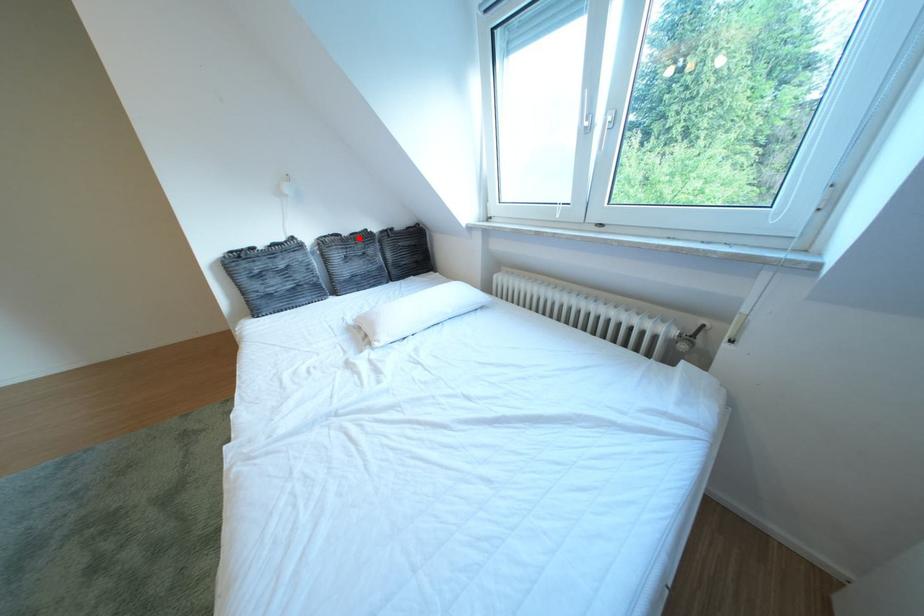
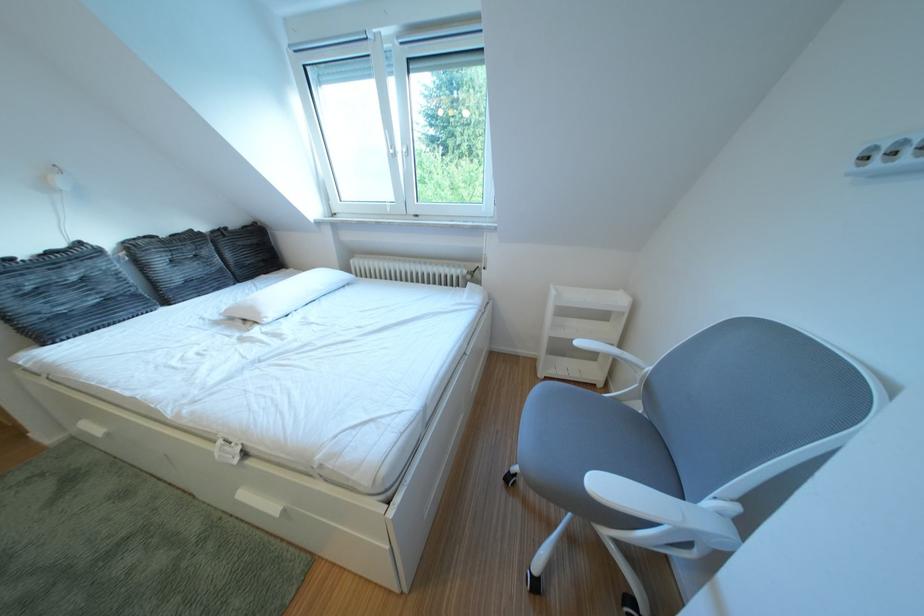
Question: I am providing you with two images of the same scene from different viewpoints. A red point is shown in image1. For the corresponding object point in image2, is it positioned nearer or farther from the camera?

Choices:
 (A) Nearer
 (B) Farther

Answer: (B)